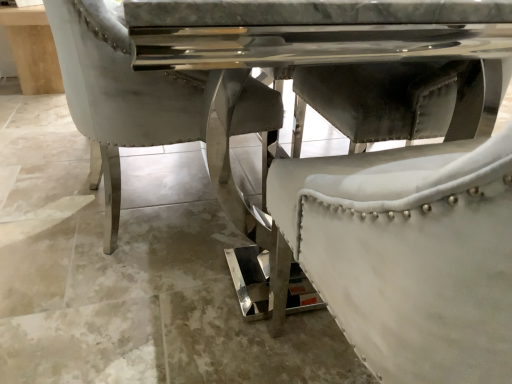
Question: Could you tell me if white leather table at upper center is facing white leather chair at center?

Choices:
 (A) no
 (B) yes

Answer: (B)

Question: Are white leather table at upper center and white leather chair at center far apart?

Choices:
 (A) yes
 (B) no

Answer: (A)

Question: Is white leather table at upper center smaller than white leather chair at center?

Choices:
 (A) no
 (B) yes

Answer: (B)

Question: Is white leather table at upper center positioned behind white leather chair at center?

Choices:
 (A) no
 (B) yes

Answer: (B)

Question: Does white leather table at upper center come in front of white leather chair at center?

Choices:
 (A) no
 (B) yes

Answer: (A)

Question: From the image's perspective, is white leather table at upper center located beneath white leather chair at center?

Choices:
 (A) no
 (B) yes

Answer: (A)

Question: From a real-world perspective, is white leather chair at center below white leather table at upper center?

Choices:
 (A) no
 (B) yes

Answer: (B)

Question: From the image's perspective, is white leather chair at center located beneath white leather table at upper center?

Choices:
 (A) no
 (B) yes

Answer: (B)

Question: Could white leather table at upper center be considered to be inside white leather chair at center?

Choices:
 (A) yes
 (B) no

Answer: (B)

Question: Is white leather chair at center aimed at white leather table at upper center?

Choices:
 (A) no
 (B) yes

Answer: (A)

Question: From a real-world perspective, is white leather chair at center over white leather table at upper center?

Choices:
 (A) yes
 (B) no

Answer: (B)

Question: Considering the relative sizes of white leather chair at center and white leather table at upper center in the image provided, is white leather chair at center wider than white leather table at upper center?

Choices:
 (A) no
 (B) yes

Answer: (B)

Question: Would you say white leather table at upper center is inside or outside white leather chair at center?

Choices:
 (A) outside
 (B) inside

Answer: (A)